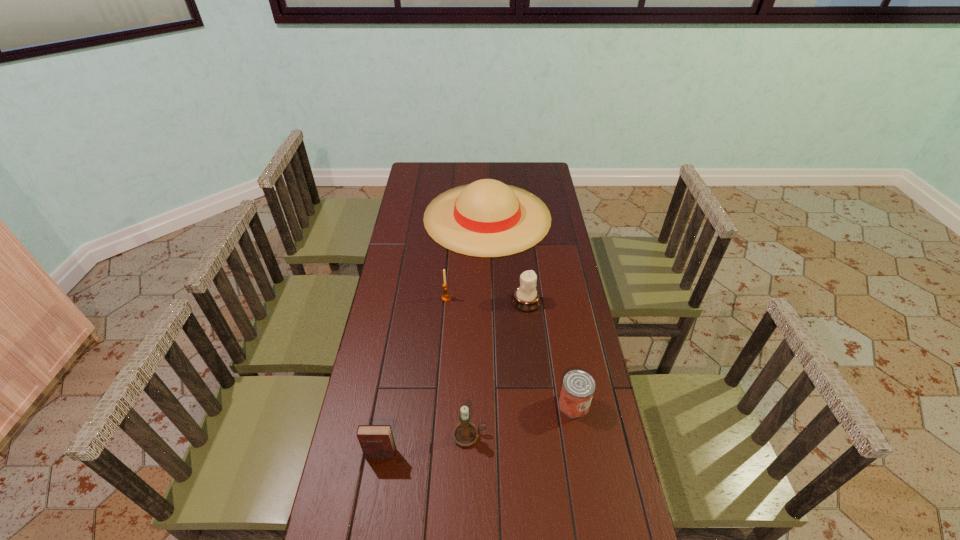
You are a GUI agent. You are given a task and a screenshot of the screen. Output one action in this format:
    pyautogui.click(x=<x>, y=<y>)
    Task: Click on the second closest candle holder to the farthest object
    
    Given the screenshot: What is the action you would take?
    pyautogui.click(x=445, y=297)

Identify the location of free point that satisfies the following two spatial constraints: 1. on the side of the fifth farthest object with the handle; 2. on the front cover of the nearest object. (468, 454).

Find the location of a particular element. free space in the image that satisfies the following two spatial constraints: 1. on the front side of the sombrero; 2. on the right side of the rightmost candle holder is located at coordinates (489, 301).